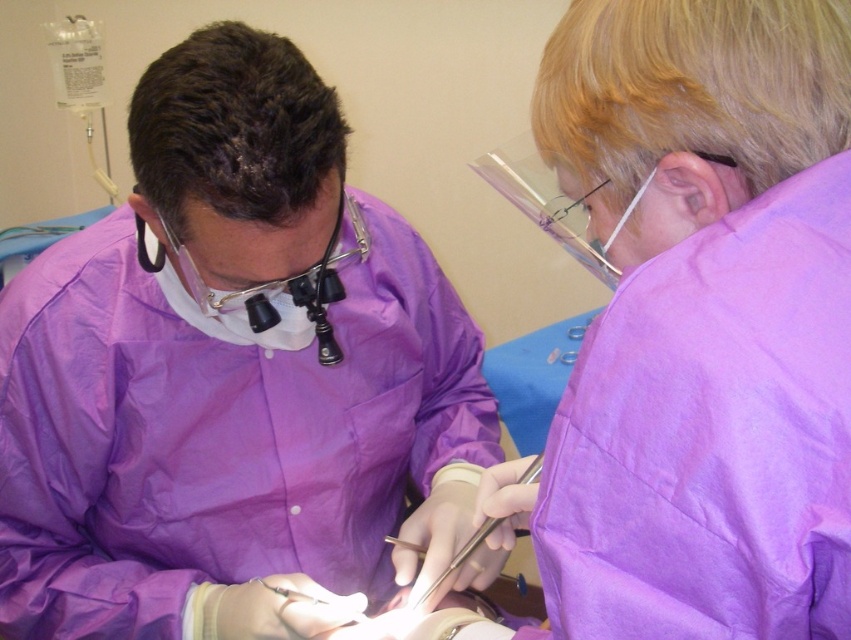
You are a medical student observing a dental procedure. You notice the purple matte surgical gown at center and the metallic silver scalpel at center. Which object would you estimate has a greater surface area?

The purple matte surgical gown at center has a greater surface area than the metallic silver scalpel at center because it is larger in size.

You are a medical student observing a dental procedure. You need to hand the metallic silver scalpel at center to the dentist wearing the purple matte surgical gown at center. Can you reach the scalpel from your current position without moving your feet?

The purple matte surgical gown at center and metallic silver scalpel at center are 10.04 inches apart, so yes, you can reach the scalpel from your current position without moving your feet since the distance is within a typical arm reach.

You are a medical student observing a dental procedure. You notice the purple matte surgical gown at center and the metallic silver scalpel at center. Which object is closer to the top of the image?

The purple matte surgical gown at center is located above the metallic silver scalpel at center, so it is closer to the top of the image.